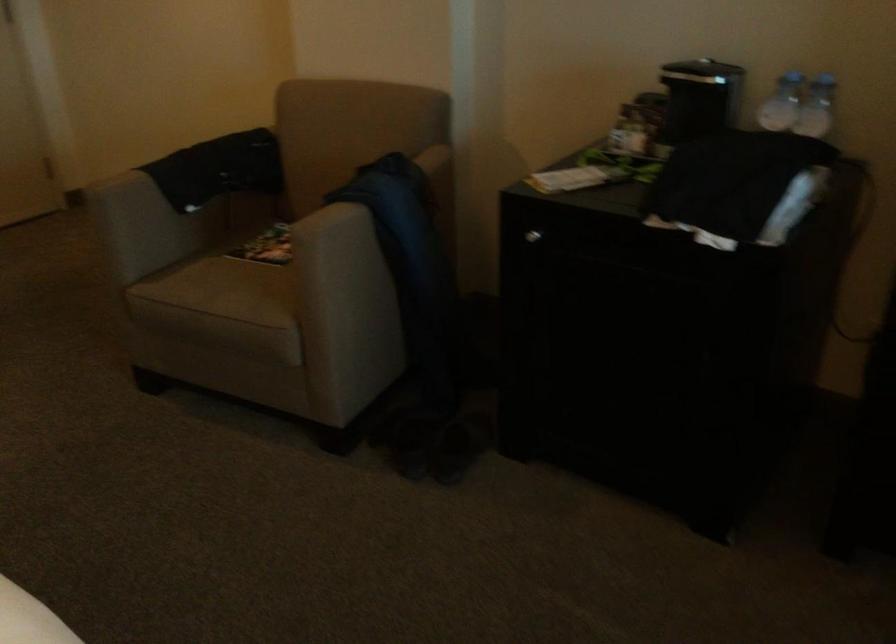
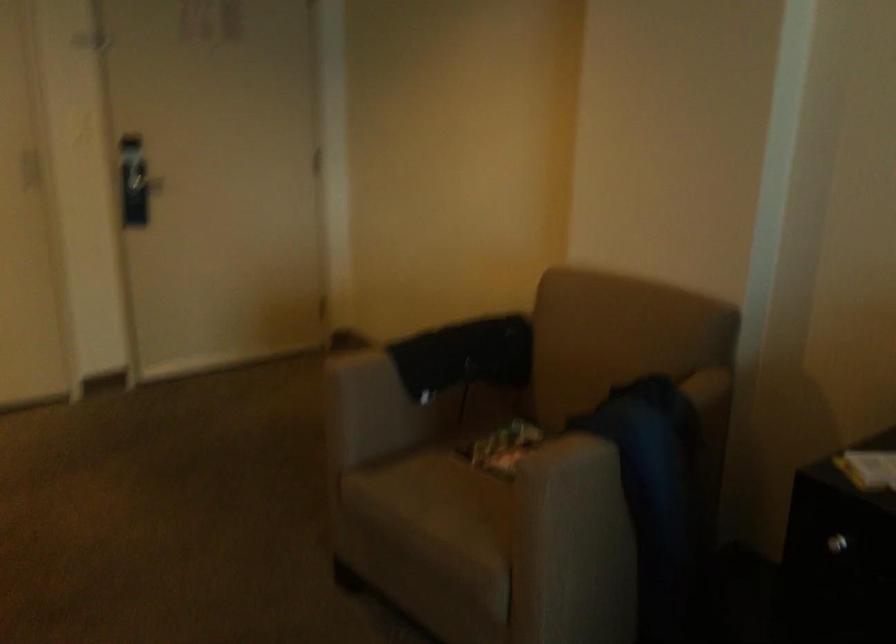
The point at (349, 198) is marked in the first image. Where is the corresponding point in the second image?

(597, 433)